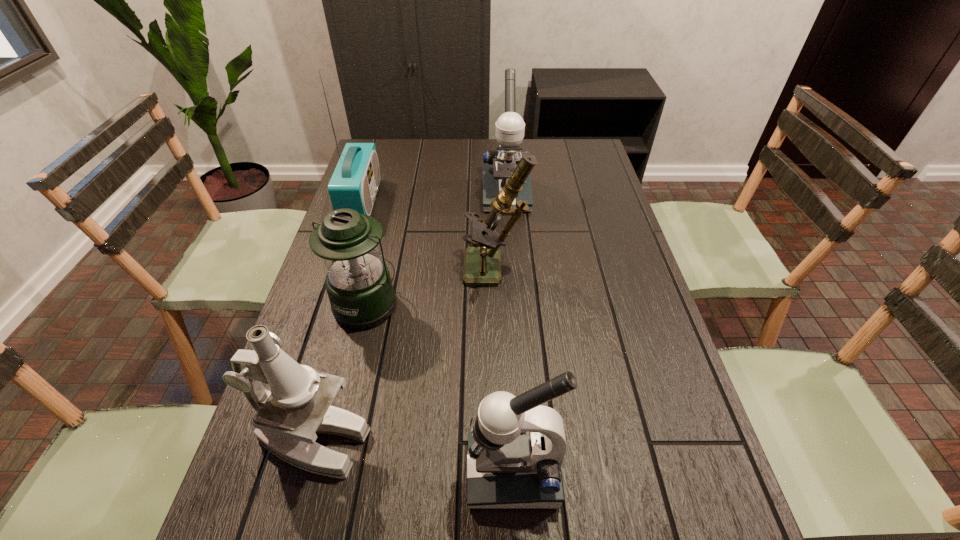
Find the location of a particular element. radio receiver is located at coordinates (354, 184).

This screenshot has height=540, width=960. What are the coordinates of `the farthest microscope` in the screenshot? It's located at (510, 127).

At what (x,y) coordinates should I click in order to perform the action: click on the third nearest microscope. Please return your answer as a coordinate pair (x, y). The width and height of the screenshot is (960, 540). Looking at the image, I should click on 482,266.

Identify the location of the leftmost microscope. This screenshot has height=540, width=960. (298, 407).

At what (x,y) coordinates should I click in order to perform the action: click on the shortest object. Please return your answer as a coordinate pair (x, y). The image size is (960, 540). Looking at the image, I should click on (358, 283).

Find the location of `vacant point located 0.300m on the front panel of the radio receiver`. vacant point located 0.300m on the front panel of the radio receiver is located at coordinates (468, 202).

Locate an element on the screen. free spot located on the back of the farthest microscope is located at coordinates (503, 159).

Image resolution: width=960 pixels, height=540 pixels. I want to click on free region located at the eyepiece of the second farthest microscope, so click(333, 272).

Locate an element on the screen. vacant space situated at the eyepiece of the second farthest microscope is located at coordinates (410, 272).

Locate an element on the screen. The height and width of the screenshot is (540, 960). vacant area located at the eyepiece of the second farthest microscope is located at coordinates (325, 272).